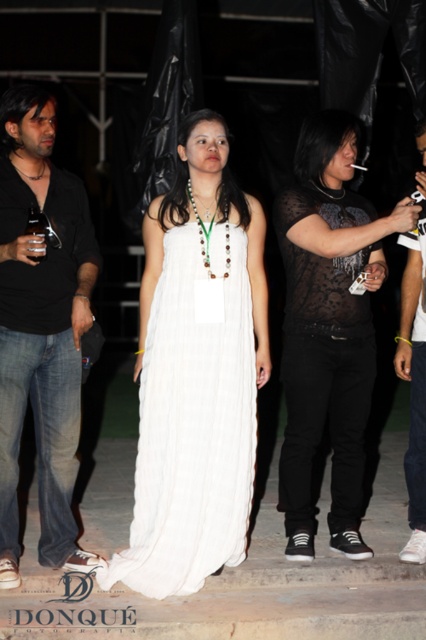
Measure the distance between white pleated dress at center and black matte shirt at left.

The distance of white pleated dress at center from black matte shirt at left is 23.37 inches.

Can you confirm if white pleated dress at center is positioned to the left of black matte shirt at left?

No, white pleated dress at center is not to the left of black matte shirt at left.

Where is `white pleated dress at center`? white pleated dress at center is located at coordinates (192, 420).

The image size is (426, 640). In order to click on white pleated dress at center in this screenshot , I will do `click(192, 420)`.

Who is more forward, (69, 435) or (423, 468)?

Point (69, 435) is in front.

Does black matte shirt at left lie in front of white fabric shirt at right?

Yes, it is.

Which is in front, point (28, 252) or point (420, 240)?

Point (28, 252)

Locate an element on the screen. The height and width of the screenshot is (640, 426). black matte shirt at left is located at coordinates (40, 326).

Between matte black dress at center and white fabric shirt at right, which one has less height?

white fabric shirt at right

What do you see at coordinates (328, 328) in the screenshot? This screenshot has height=640, width=426. I see `matte black dress at center` at bounding box center [328, 328].

The width and height of the screenshot is (426, 640). Identify the location of matte black dress at center. (328, 328).